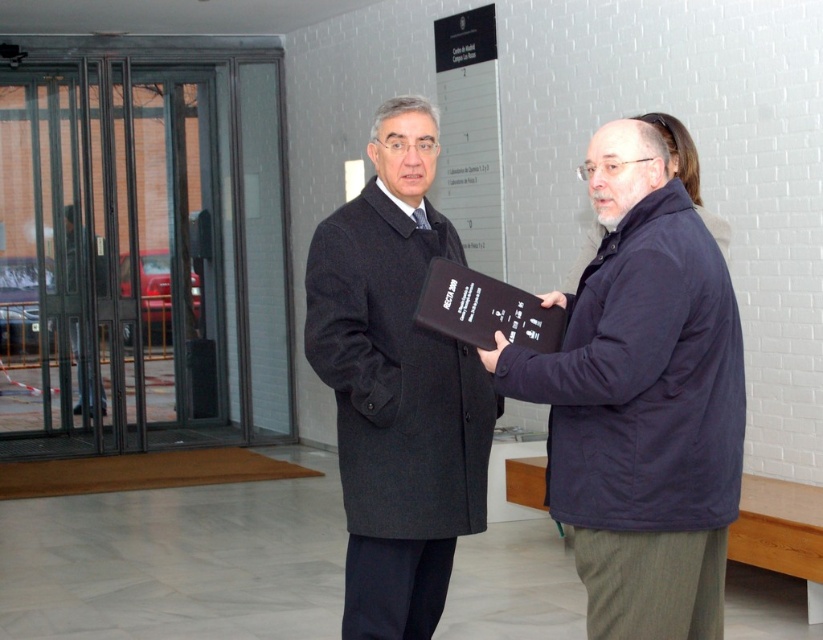
You are a delivery person who needs to place both the black matte book at center and the dark gray wool coat at center on a shelf. The shelf has a height limit of 15 cm. Which item can you place on the shelf without exceeding the height limit?

The black matte book at center is shorter than the dark gray wool coat at center, so it can be placed on the shelf without exceeding the 15 cm height limit.

You are standing in the room and want to place a new book on the existing shelf. The existing shelf is located at point [642,396]. Where should you place the new book?

The new book should be placed at the same location as the existing shelf at point [642,396] where the black matte book at center is located.

You are organizing a display in a museum and need to place the black matte book at center and the dark gray wool coat at center on a shelf. Given their sizes, which object should be placed first to ensure proper arrangement?

The black matte book at center should be placed first since it is smaller than the dark gray wool coat at center, allowing for better organization on the shelf.